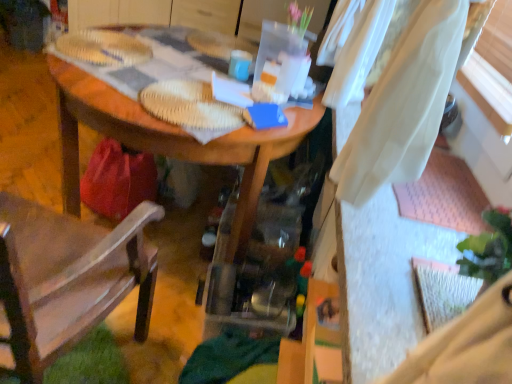
Question: Can we say brown fabric chair at left lies outside matte blue mug at center?

Choices:
 (A) no
 (B) yes

Answer: (B)

Question: From the image's perspective, does brown fabric chair at left appear lower than matte blue mug at center?

Choices:
 (A) yes
 (B) no

Answer: (A)

Question: Does brown fabric chair at left lie behind matte blue mug at center?

Choices:
 (A) no
 (B) yes

Answer: (A)

Question: Is brown fabric chair at left to the left of matte blue mug at center from the viewer's perspective?

Choices:
 (A) no
 (B) yes

Answer: (B)

Question: From the image's perspective, is brown fabric chair at left over matte blue mug at center?

Choices:
 (A) no
 (B) yes

Answer: (A)

Question: In the image, is brown fabric chair at left positioned in front of or behind matte blue mug at center?

Choices:
 (A) behind
 (B) front

Answer: (B)

Question: Would you say brown fabric chair at left is to the left or to the right of matte blue mug at center in the picture?

Choices:
 (A) right
 (B) left

Answer: (B)

Question: Does point (77, 231) appear closer or farther from the camera than point (244, 79)?

Choices:
 (A) closer
 (B) farther

Answer: (A)

Question: From a real-world perspective, relative to matte blue mug at center, is brown fabric chair at left vertically above or below?

Choices:
 (A) below
 (B) above

Answer: (A)

Question: In terms of height, does wooden desk at center look taller or shorter compared to brown fabric chair at left?

Choices:
 (A) short
 (B) tall

Answer: (A)

Question: From a real-world perspective, is wooden desk at center above or below brown fabric chair at left?

Choices:
 (A) above
 (B) below

Answer: (B)

Question: Considering the positions of point (232, 254) and point (22, 292), is point (232, 254) closer or farther from the camera than point (22, 292)?

Choices:
 (A) closer
 (B) farther

Answer: (B)

Question: In terms of size, does wooden desk at center appear bigger or smaller than brown fabric chair at left?

Choices:
 (A) big
 (B) small

Answer: (A)

Question: Is brown fabric chair at left taller or shorter than wooden desk at center?

Choices:
 (A) tall
 (B) short

Answer: (A)

Question: From a real-world perspective, is brown fabric chair at left above or below wooden desk at center?

Choices:
 (A) below
 (B) above

Answer: (B)